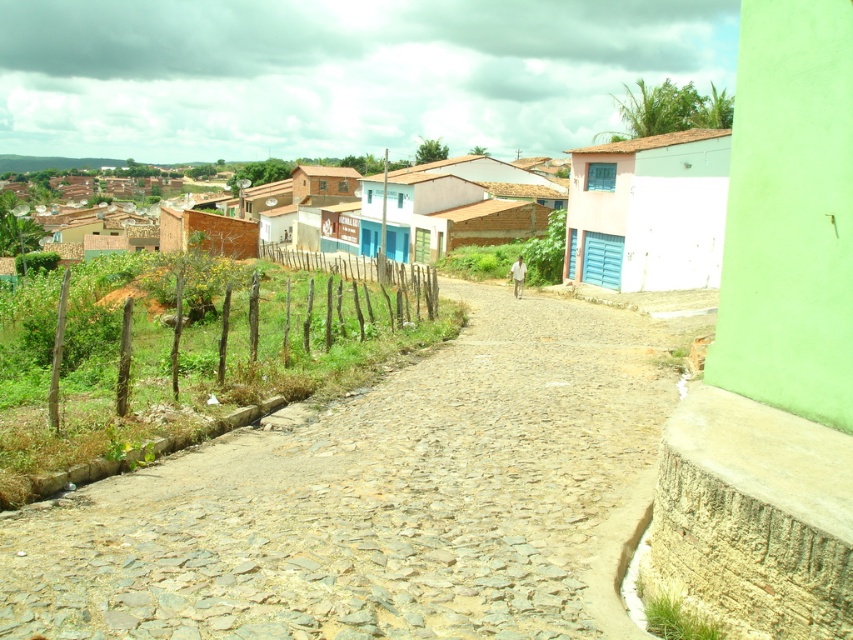
You are standing at the starting point of the cobblestone path in the rural village. You see two points marked on the path. The first point is at coordinates point (254, 406) and the second point is at coordinates point (250, 248). Which point is closer to you as you begin walking along the path?

Point (254, 406) is closer to you because it is in front of point (250, 248) along the path.